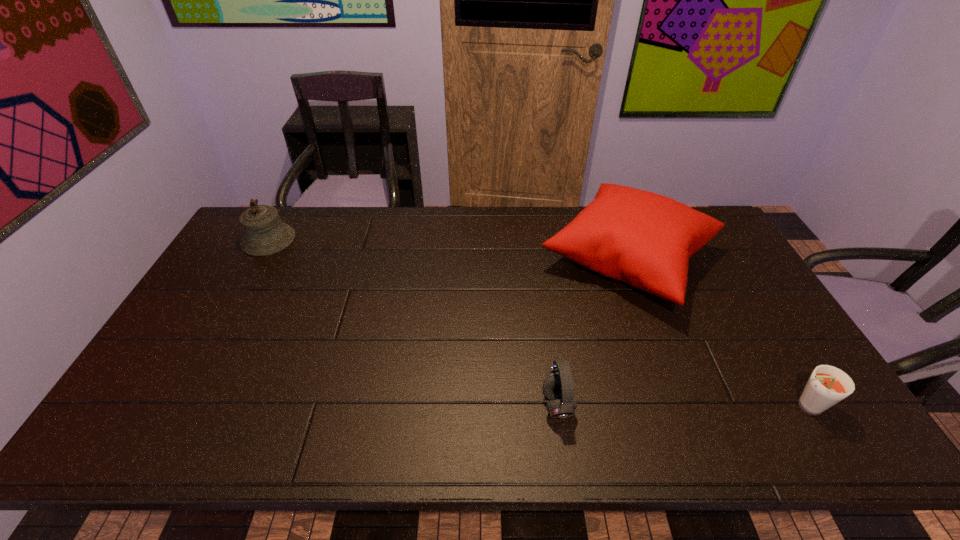
Image resolution: width=960 pixels, height=540 pixels. I want to click on vacant region located on the ear cups of the headset, so click(439, 405).

At what (x,y) coordinates should I click in order to perform the action: click on vacant region located on the ear cups of the headset. Please return your answer as a coordinate pair (x, y). The image size is (960, 540). Looking at the image, I should click on (414, 405).

You are a GUI agent. You are given a task and a screenshot of the screen. Output one action in this format:
    pyautogui.click(x=<x>, y=<y>)
    Task: Click on the cushion located at the far edge
    Image resolution: width=960 pixels, height=540 pixels.
    Given the screenshot: What is the action you would take?
    pyautogui.click(x=645, y=239)

Where is `bell present at the far edge`? bell present at the far edge is located at coordinates (264, 233).

Where is `root beer situated at the near edge`? This screenshot has width=960, height=540. root beer situated at the near edge is located at coordinates (827, 386).

This screenshot has width=960, height=540. Identify the location of headset that is at the near edge. (558, 387).

Find the location of a particular element. object at the left edge is located at coordinates (264, 233).

The height and width of the screenshot is (540, 960). In order to click on cushion located in the right edge section of the desktop in this screenshot , I will do `click(645, 239)`.

The width and height of the screenshot is (960, 540). What are the coordinates of `root beer that is at the right edge` in the screenshot? It's located at (827, 386).

Identify the location of object at the far left corner. The width and height of the screenshot is (960, 540). (264, 233).